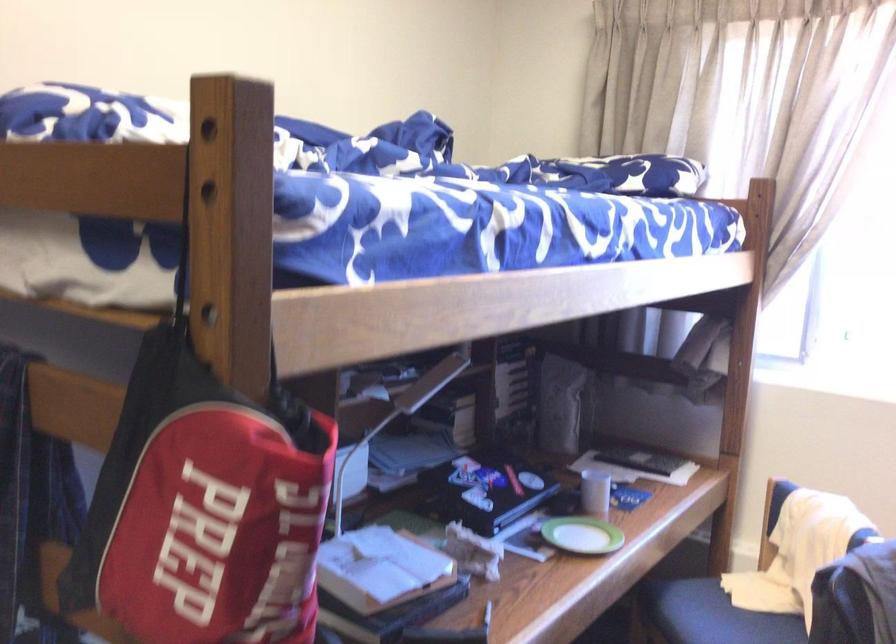
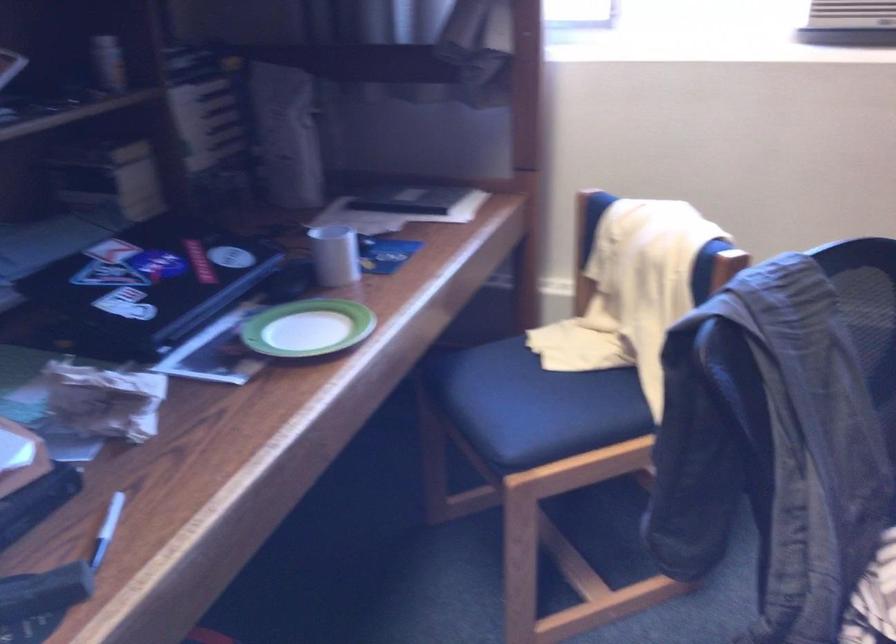
In the second image, find the point that corresponds to point 573,538 in the first image.

(307, 328)